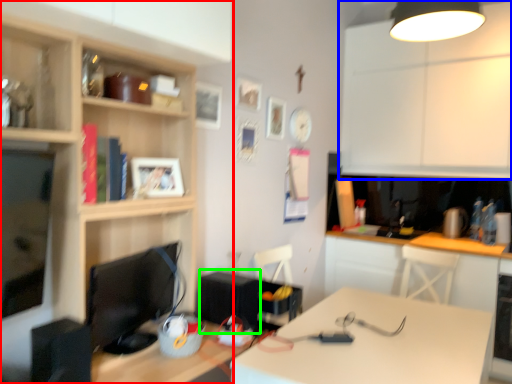
Question: Which object is positioned farthest from cabinetry (highlighted by a red box)? Select from cabinetry (highlighted by a blue box) and appliance (highlighted by a green box).

Choices:
 (A) cabinetry
 (B) appliance

Answer: (A)